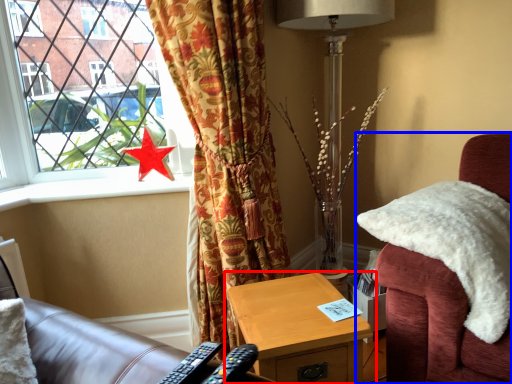
Question: Which object appears closest to the camera in this image, nightstand (highlighted by a red box) or chair (highlighted by a blue box)?

Choices:
 (A) nightstand
 (B) chair

Answer: (B)